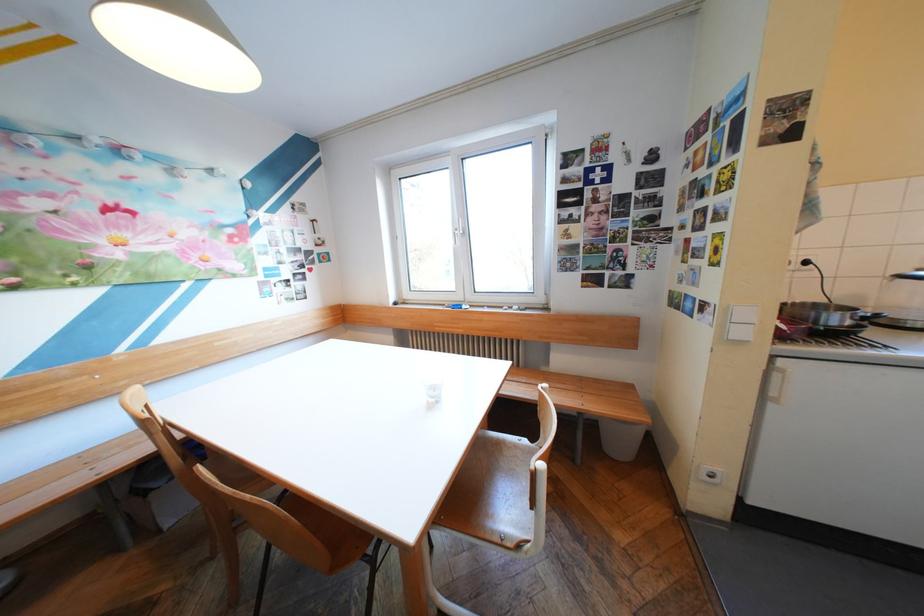
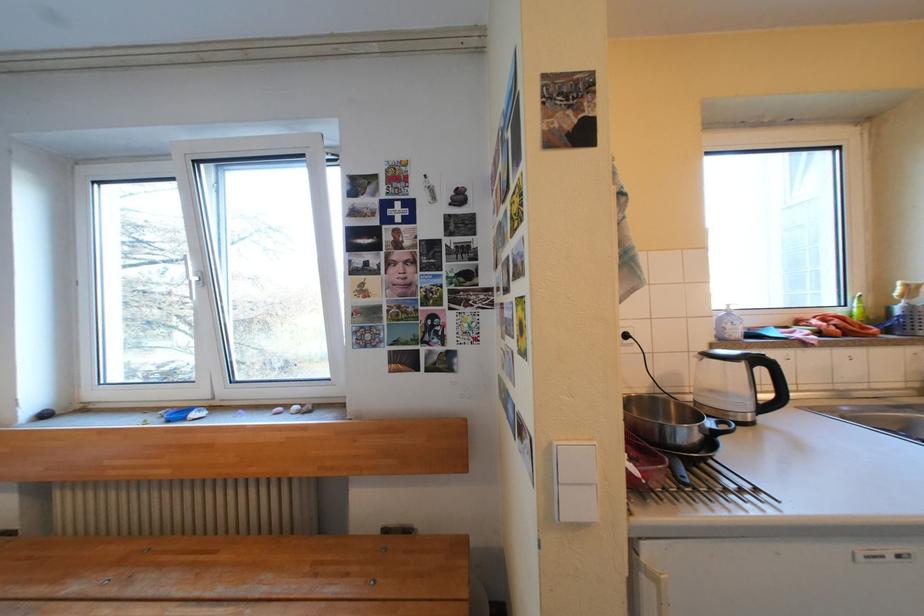
Which direction would the cameraman need to move to produce the second image?

The movement direction of the cameraman is right, forward.